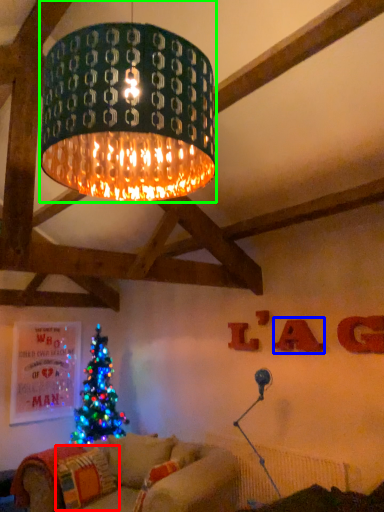
Question: Estimate the real-world distances between objects in this image. Which object is closer to pillow (highlighted by a red box), letter (highlighted by a blue box) or lamp (highlighted by a green box)?

Choices:
 (A) letter
 (B) lamp

Answer: (A)